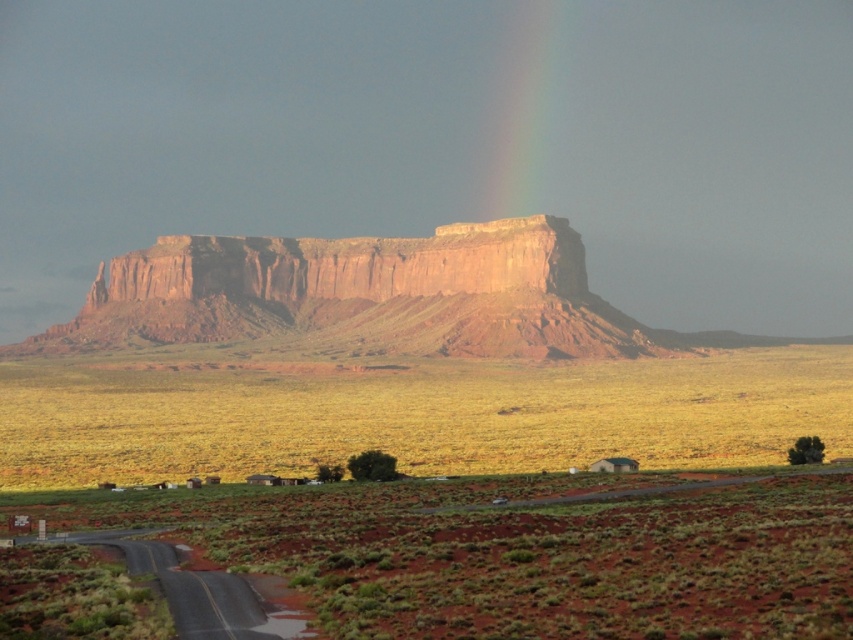
Question: Can you confirm if yellow grassland at lower center is positioned to the left of rainbow translucent at upper center?

Choices:
 (A) no
 (B) yes

Answer: (B)

Question: Which is farther from the rainbow translucent at upper center?

Choices:
 (A) rustic sandstone mesa at center
 (B) green grass at lower center

Answer: (B)

Question: Does green grass at lower center have a larger size compared to rainbow translucent at upper center?

Choices:
 (A) yes
 (B) no

Answer: (B)

Question: In this image, where is green grass at lower center located relative to rustic sandstone mesa at center?

Choices:
 (A) below
 (B) above

Answer: (A)

Question: Estimate the real-world distances between objects in this image. Which object is closer to the rustic sandstone mesa at center?

Choices:
 (A) rainbow translucent at upper center
 (B) green grass at lower center

Answer: (A)

Question: Which of the following is the closest to the observer?

Choices:
 (A) rainbow translucent at upper center
 (B) green grass at lower center
 (C) yellow grassland at lower center

Answer: (B)